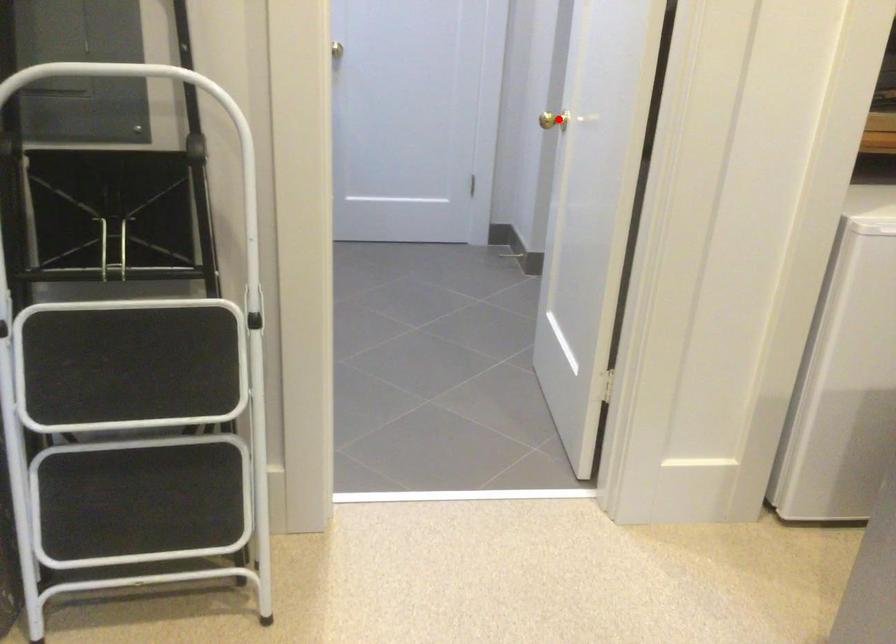
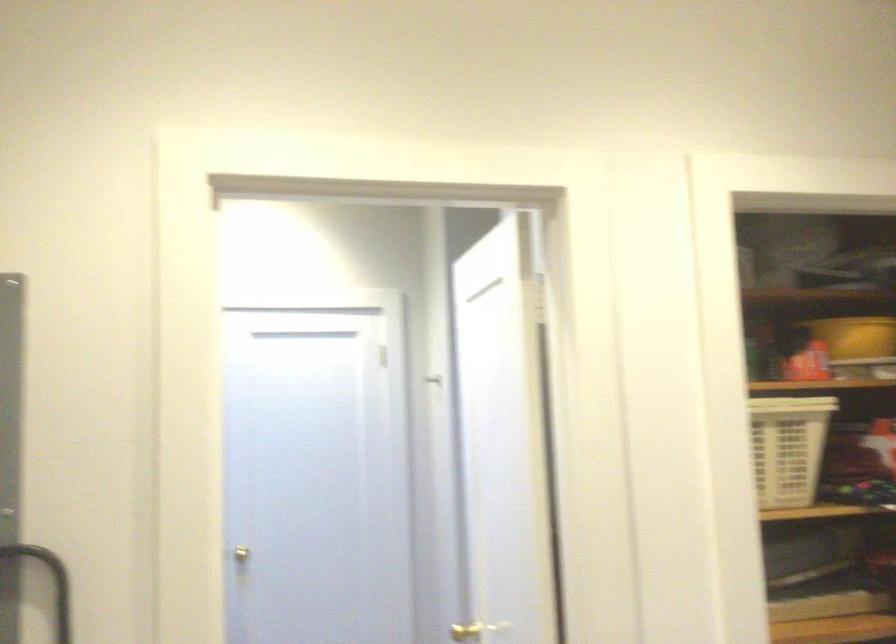
Find the pixel in the second image that matches the highlighted location in the first image.

(464, 632)